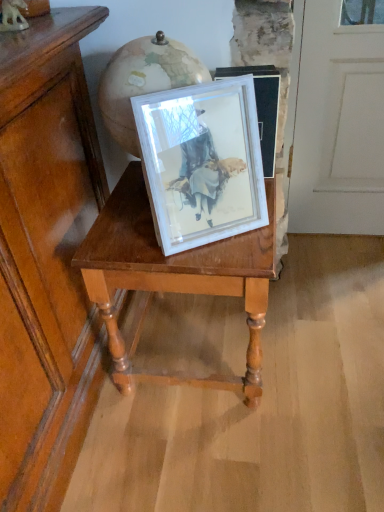
Question: Is wooden table at center turned away from white matte picture frame at center?

Choices:
 (A) yes
 (B) no

Answer: (B)

Question: Is white matte picture frame at center surrounded by wooden table at center?

Choices:
 (A) no
 (B) yes

Answer: (A)

Question: From the image's perspective, is wooden table at center over white matte picture frame at center?

Choices:
 (A) no
 (B) yes

Answer: (A)

Question: From a real-world perspective, is wooden table at center located higher than white matte picture frame at center?

Choices:
 (A) yes
 (B) no

Answer: (B)

Question: Is there a large distance between wooden table at center and white matte picture frame at center?

Choices:
 (A) yes
 (B) no

Answer: (B)

Question: Considering the relative positions of wooden table at center and white matte picture frame at center in the image provided, is wooden table at center to the right of white matte picture frame at center from the viewer's perspective?

Choices:
 (A) no
 (B) yes

Answer: (A)

Question: From a real-world perspective, is white matte picture frame at center on top of wooden table at center?

Choices:
 (A) yes
 (B) no

Answer: (A)

Question: From a real-world perspective, is white matte picture frame at center under wooden table at center?

Choices:
 (A) no
 (B) yes

Answer: (A)

Question: Is the position of white matte picture frame at center more distant than that of wooden table at center?

Choices:
 (A) yes
 (B) no

Answer: (B)

Question: From the image's perspective, is white matte picture frame at center on top of wooden table at center?

Choices:
 (A) no
 (B) yes

Answer: (B)

Question: Does white matte picture frame at center have a lesser height compared to wooden table at center?

Choices:
 (A) yes
 (B) no

Answer: (A)

Question: Is white matte picture frame at center at the right side of wooden table at center?

Choices:
 (A) yes
 (B) no

Answer: (A)

Question: Looking at their shapes, would you say white matte picture frame at center is wider or thinner than wooden table at center?

Choices:
 (A) thin
 (B) wide

Answer: (A)